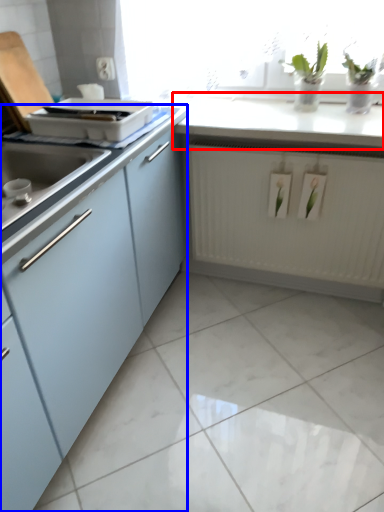
Question: Which point is further to the camera, countertop (highlighted by a red box) or cabinetry (highlighted by a blue box)?

Choices:
 (A) countertop
 (B) cabinetry

Answer: (A)